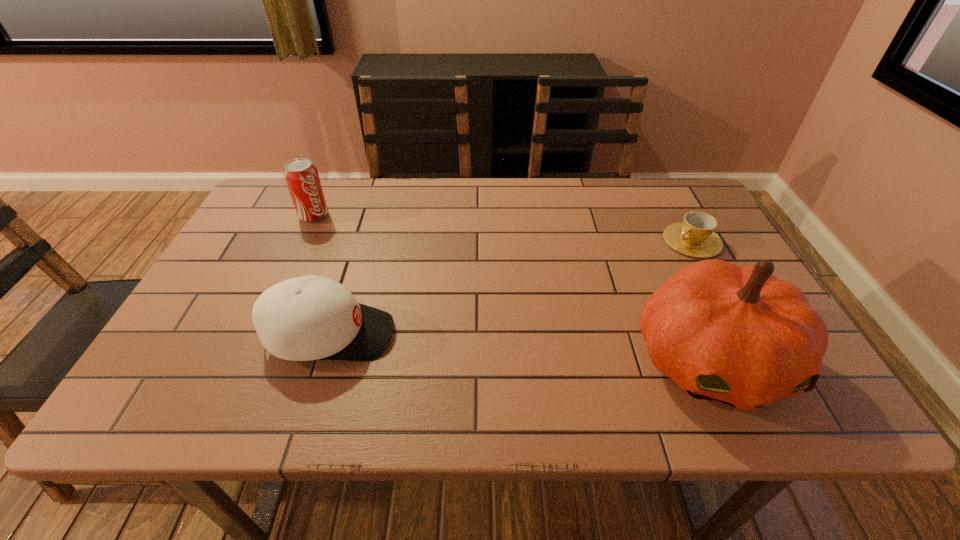
Identify the location of object present at the near right corner. (735, 334).

The height and width of the screenshot is (540, 960). In order to click on free space at the far edge in this screenshot , I will do `click(607, 204)`.

In the image, there is a desktop. Identify the location of vacant space at the near edge. This screenshot has height=540, width=960. (265, 375).

You are a GUI agent. You are given a task and a screenshot of the screen. Output one action in this format:
    pyautogui.click(x=<x>, y=<y>)
    Task: Click on the free space at the left edge of the desktop
    The height and width of the screenshot is (540, 960).
    Given the screenshot: What is the action you would take?
    pyautogui.click(x=200, y=313)

Find the location of a particular element. This screenshot has width=960, height=540. free space at the far left corner is located at coordinates (274, 201).

Locate an element on the screen. This screenshot has width=960, height=540. vacant point at the near left corner is located at coordinates (201, 368).

Identify the location of vacant space at the far right corner of the desktop. (643, 180).

The width and height of the screenshot is (960, 540). What are the coordinates of `free space between the third tallest object and the pumpkin` in the screenshot? It's located at (520, 347).

Locate an element on the screen. This screenshot has height=540, width=960. free space between the soda can and the second shortest object is located at coordinates [x=322, y=275].

Find the location of a particular element. Image resolution: width=960 pixels, height=540 pixels. free spot between the third tallest object and the soda can is located at coordinates (322, 275).